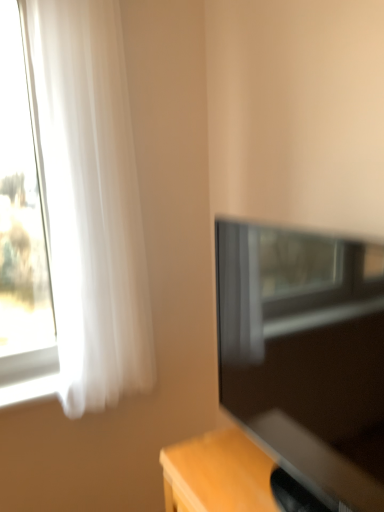
Question: Considering their positions, is matte black tv at right located in front of or behind white sheer curtain at left?

Choices:
 (A) front
 (B) behind

Answer: (A)

Question: In terms of width, does matte black tv at right look wider or thinner when compared to white sheer curtain at left?

Choices:
 (A) wide
 (B) thin

Answer: (A)

Question: Does point (279, 314) appear closer or farther from the camera than point (71, 280)?

Choices:
 (A) closer
 (B) farther

Answer: (A)

Question: From the image's perspective, is white sheer curtain at left above or below matte black tv at right?

Choices:
 (A) above
 (B) below

Answer: (A)

Question: Would you say white sheer curtain at left is inside or outside matte black tv at right?

Choices:
 (A) outside
 (B) inside

Answer: (A)

Question: Would you say white sheer curtain at left is to the left or to the right of matte black tv at right in the picture?

Choices:
 (A) left
 (B) right

Answer: (A)

Question: Is point (43, 135) positioned closer to the camera than point (377, 495)?

Choices:
 (A) farther
 (B) closer

Answer: (A)